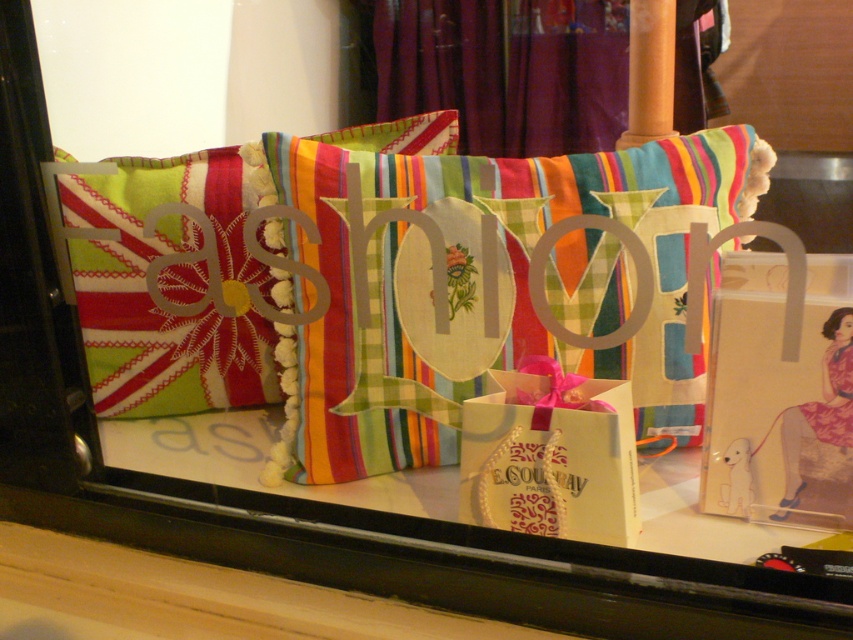
Who is taller, striped fabric pillow at center or textured fabric pillow at center?

Standing taller between the two is textured fabric pillow at center.

Does striped fabric pillow at center come in front of textured fabric pillow at center?

Yes, striped fabric pillow at center is in front of textured fabric pillow at center.

I want to click on striped fabric pillow at center, so click(479, 288).

Locate an element on the screen. striped fabric pillow at center is located at coordinates (479, 288).

Is textured fabric pillow at center below white paper gift bag at center?

No, textured fabric pillow at center is not below white paper gift bag at center.

Who is higher up, textured fabric pillow at center or white paper gift bag at center?

textured fabric pillow at center is above.

What do you see at coordinates (171, 284) in the screenshot? The image size is (853, 640). I see `textured fabric pillow at center` at bounding box center [171, 284].

Find the location of a particular element. The image size is (853, 640). textured fabric pillow at center is located at coordinates coord(171,284).

Is striped fabric pillow at center positioned before white paper gift bag at center?

Yes, it is.

Is point (509, 308) farther from camera compared to point (474, 500)?

Yes, point (509, 308) is behind point (474, 500).

Does point (305, 451) come behind point (506, 417)?

That is True.

You are a GUI agent. You are given a task and a screenshot of the screen. Output one action in this format:
    pyautogui.click(x=<x>, y=<y>)
    Task: Click on the striped fabric pillow at center
    The height and width of the screenshot is (640, 853).
    Given the screenshot: What is the action you would take?
    pyautogui.click(x=479, y=288)